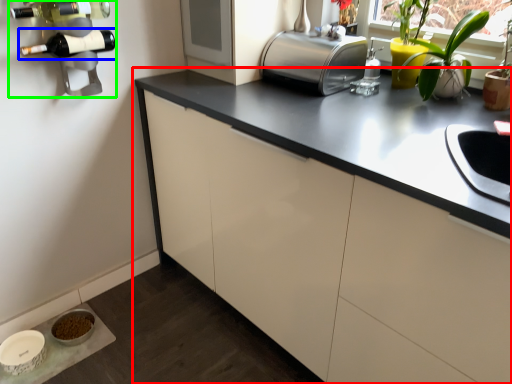
Question: Which object is positioned farthest from cabinetry (highlighted by a red box)? Select from wine bottle (highlighted by a blue box) and wine rack (highlighted by a green box).

Choices:
 (A) wine bottle
 (B) wine rack

Answer: (A)